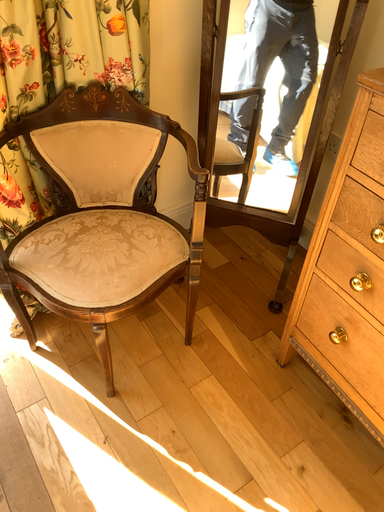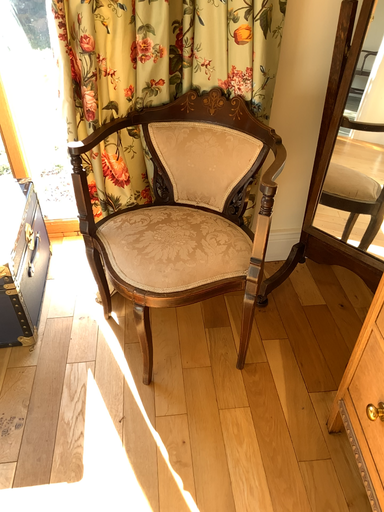
Question: Which way did the camera rotate in the video?

Choices:
 (A) rotated downward
 (B) rotated upward

Answer: (B)